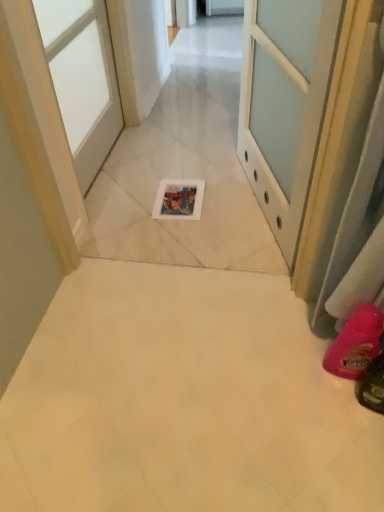
What do you see at coordinates (82, 79) in the screenshot? I see `white glossy door at upper left, acting as the 1th door starting from the left` at bounding box center [82, 79].

Where is `pink rubber boot at lower right`? pink rubber boot at lower right is located at coordinates (356, 343).

What are the coordinates of `white glossy door at upper center, placed as the first door when sorted from right to left` in the screenshot? It's located at (x=284, y=104).

Locate an element on the screen. white glossy door at upper left, acting as the 1th door starting from the left is located at coordinates (82, 79).

Do you think pink rubber boot at lower right is within white glossy door at upper center, placed as the first door when sorted from right to left, or outside of it?

pink rubber boot at lower right is not inside white glossy door at upper center, placed as the first door when sorted from right to left, it's outside.

Looking at this image, is the depth of pink rubber boot at lower right less than that of white glossy door at upper center, which appears as the 2th door when viewed from the left?

No.

The width and height of the screenshot is (384, 512). I want to click on door above the white glossy door at upper center, which appears as the 2th door when viewed from the left (from the image's perspective), so click(x=82, y=79).

Does white glossy door at upper left, acting as the 1th door starting from the left, have a greater height compared to white glossy door at upper center, placed as the first door when sorted from right to left?

No, white glossy door at upper left, acting as the 1th door starting from the left, is not taller than white glossy door at upper center, placed as the first door when sorted from right to left.

In the scene shown: Is white glossy door at upper left, acting as the 1th door starting from the left, looking in the opposite direction of white glossy door at upper center, placed as the first door when sorted from right to left?

No.

From a real-world perspective, who is located lower, white glossy door at upper left, acting as the 1th door starting from the left, or white glossy door at upper center, placed as the first door when sorted from right to left?

white glossy door at upper left, acting as the 1th door starting from the left, from a real-world perspective.

From the image's perspective, is white glossy door at upper center, placed as the first door when sorted from right to left, below white glossy door at upper left, the second door from the right?

Correct, white glossy door at upper center, placed as the first door when sorted from right to left, appears lower than white glossy door at upper left, the second door from the right, in the image.

Considering the relative sizes of white glossy door at upper center, placed as the first door when sorted from right to left, and white glossy door at upper left, the second door from the right, in the image provided, is white glossy door at upper center, placed as the first door when sorted from right to left, wider than white glossy door at upper left, the second door from the right,?

Indeed, white glossy door at upper center, placed as the first door when sorted from right to left, has a greater width compared to white glossy door at upper left, the second door from the right.

Is white glossy door at upper center, which appears as the 2th door when viewed from the left, shorter than white glossy door at upper left, acting as the 1th door starting from the left?

In fact, white glossy door at upper center, which appears as the 2th door when viewed from the left, may be taller than white glossy door at upper left, acting as the 1th door starting from the left.

Which object is positioned more to the right, white glossy door at upper center, placed as the first door when sorted from right to left, or white glossy door at upper left, the second door from the right?

white glossy door at upper center, placed as the first door when sorted from right to left, is more to the right.

In the scene shown: From a real-world perspective, which is physically above, white glossy door at upper left, the second door from the right, or pink rubber boot at lower right?

In real-world perspective, white glossy door at upper left, the second door from the right, is above.

Based on the photo, which object is closer to the camera taking this photo, white glossy door at upper left, acting as the 1th door starting from the left, or pink rubber boot at lower right?

pink rubber boot at lower right is more forward.

Which of these two, white glossy door at upper left, the second door from the right, or pink rubber boot at lower right, is thinner?

With smaller width is white glossy door at upper left, the second door from the right.

Considering the sizes of objects white glossy door at upper left, acting as the 1th door starting from the left, and pink rubber boot at lower right in the image provided, who is taller, white glossy door at upper left, acting as the 1th door starting from the left, or pink rubber boot at lower right?

white glossy door at upper left, acting as the 1th door starting from the left, is taller.

Is pink rubber boot at lower right shorter than white glossy door at upper left, the second door from the right?

Indeed, pink rubber boot at lower right has a lesser height compared to white glossy door at upper left, the second door from the right.

At what (x,y) coordinates should I click in order to perform the action: click on footwear directly beneath the white glossy door at upper left, acting as the 1th door starting from the left (from a real-world perspective). Please return your answer as a coordinate pair (x, y). Looking at the image, I should click on (356, 343).

Between point (379, 351) and point (71, 36), which one is positioned in front?

Point (379, 351)

Does pink rubber boot at lower right contain white glossy door at upper left, acting as the 1th door starting from the left?

Definitely not — white glossy door at upper left, acting as the 1th door starting from the left, is not inside pink rubber boot at lower right.

Is white glossy door at upper center, which appears as the 2th door when viewed from the left, inside or outside of pink rubber boot at lower right?

white glossy door at upper center, which appears as the 2th door when viewed from the left, is outside pink rubber boot at lower right.

Which object is positioned more to the left, white glossy door at upper center, placed as the first door when sorted from right to left, or pink rubber boot at lower right?

white glossy door at upper center, placed as the first door when sorted from right to left, is more to the left.

The height and width of the screenshot is (512, 384). I want to click on footwear behind the white glossy door at upper center, which appears as the 2th door when viewed from the left, so click(x=356, y=343).

From the image's perspective, between white glossy door at upper center, placed as the first door when sorted from right to left, and pink rubber boot at lower right, who is located below?

pink rubber boot at lower right is shown below in the image.

Where is `footwear beneath the white glossy door at upper center, placed as the first door when sorted from right to left (from a real-world perspective)`? footwear beneath the white glossy door at upper center, placed as the first door when sorted from right to left (from a real-world perspective) is located at coordinates (356, 343).

The height and width of the screenshot is (512, 384). Find the location of `door above the white glossy door at upper center, placed as the first door when sorted from right to left (from the image's perspective)`. door above the white glossy door at upper center, placed as the first door when sorted from right to left (from the image's perspective) is located at coordinates (82, 79).

Looking at the image, which one is located further to white glossy door at upper center, placed as the first door when sorted from right to left, white glossy door at upper left, the second door from the right, or pink rubber boot at lower right?

Based on the image, white glossy door at upper left, the second door from the right, appears to be further to white glossy door at upper center, placed as the first door when sorted from right to left.

From the image, which object appears to be farther from white glossy door at upper center, placed as the first door when sorted from right to left, pink rubber boot at lower right or white glossy door at upper left, acting as the 1th door starting from the left?

Based on the image, white glossy door at upper left, acting as the 1th door starting from the left, appears to be further to white glossy door at upper center, placed as the first door when sorted from right to left.

Which object lies nearer to the anchor point white glossy door at upper left, acting as the 1th door starting from the left, pink rubber boot at lower right or white glossy door at upper center, placed as the first door when sorted from right to left?

The object closer to white glossy door at upper left, acting as the 1th door starting from the left, is white glossy door at upper center, placed as the first door when sorted from right to left.

Based on their spatial positions, is white glossy door at upper left, the second door from the right, or white glossy door at upper center, which appears as the 2th door when viewed from the left, further from pink rubber boot at lower right?

white glossy door at upper left, the second door from the right, lies further to pink rubber boot at lower right than the other object.

From the image, which object appears to be farther from pink rubber boot at lower right, white glossy door at upper center, placed as the first door when sorted from right to left, or white glossy door at upper left, acting as the 1th door starting from the left?

Among the two, white glossy door at upper left, acting as the 1th door starting from the left, is located further to pink rubber boot at lower right.

Looking at the image, which one is located further to white glossy door at upper left, the second door from the right, white glossy door at upper center, which appears as the 2th door when viewed from the left, or pink rubber boot at lower right?

Result: Among the two, pink rubber boot at lower right is located further to white glossy door at upper left, the second door from the right.

Locate an element on the screen. This screenshot has width=384, height=512. door between white glossy door at upper left, the second door from the right, and pink rubber boot at lower right in the up-down direction is located at coordinates (284, 104).